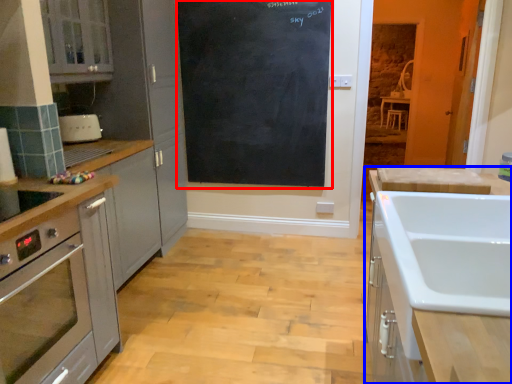
Question: Among these objects, which one is farthest to the camera, bulletin board (highlighted by a red box) or cabinetry (highlighted by a blue box)?

Choices:
 (A) bulletin board
 (B) cabinetry

Answer: (A)